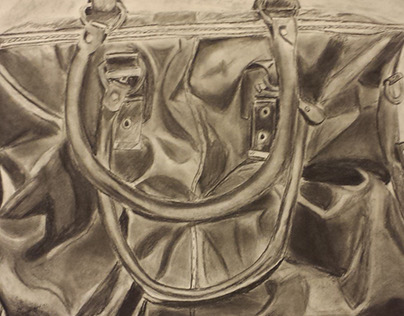
Image resolution: width=404 pixels, height=316 pixels. In order to click on upper handle in this screenshot , I will do `click(198, 212)`.